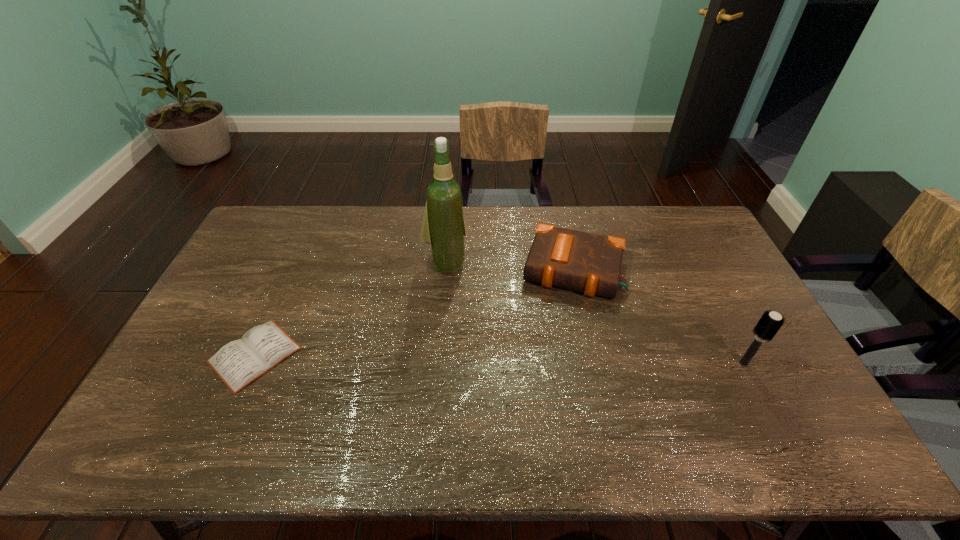
The height and width of the screenshot is (540, 960). In order to click on vacant area that lies between the wine bottle and the rightmost object in this screenshot , I will do `click(594, 313)`.

Image resolution: width=960 pixels, height=540 pixels. Find the location of `free spot between the third tallest object and the wine bottle`. free spot between the third tallest object and the wine bottle is located at coordinates (510, 266).

Locate an element on the screen. This screenshot has width=960, height=540. free space between the shortest object and the second object from right to left is located at coordinates (414, 312).

Where is `vacant space in between the wine bottle and the diary`? vacant space in between the wine bottle and the diary is located at coordinates (350, 309).

The height and width of the screenshot is (540, 960). I want to click on vacant area that lies between the hairbrush and the third object from right to left, so click(594, 313).

Where is `free area in between the hairbrush and the second object from left to right`? The image size is (960, 540). free area in between the hairbrush and the second object from left to right is located at coordinates (594, 313).

Where is `object that stands as the closest to the second shortest object`? object that stands as the closest to the second shortest object is located at coordinates (443, 228).

The image size is (960, 540). Find the location of `the closest object relative to the third shortest object`. the closest object relative to the third shortest object is located at coordinates (579, 261).

Find the location of a particular element. This screenshot has width=960, height=540. free spot that satisfies the following two spatial constraints: 1. on the front side of the Bible; 2. on the left side of the tallest object is located at coordinates (444, 269).

Locate an element on the screen. free space in the image that satisfies the following two spatial constraints: 1. on the front side of the tallest object; 2. on the right side of the hairbrush is located at coordinates (437, 363).